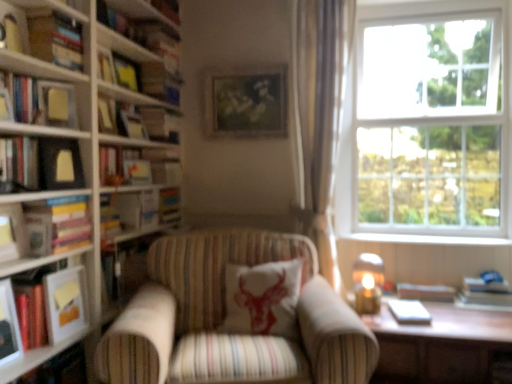
The height and width of the screenshot is (384, 512). What are the coordinates of `vacant region above wooden picture frame at upper center, marked as the fourth picture frame in a front-to-back arrangement (from a real-world perspective)` in the screenshot? It's located at (245, 64).